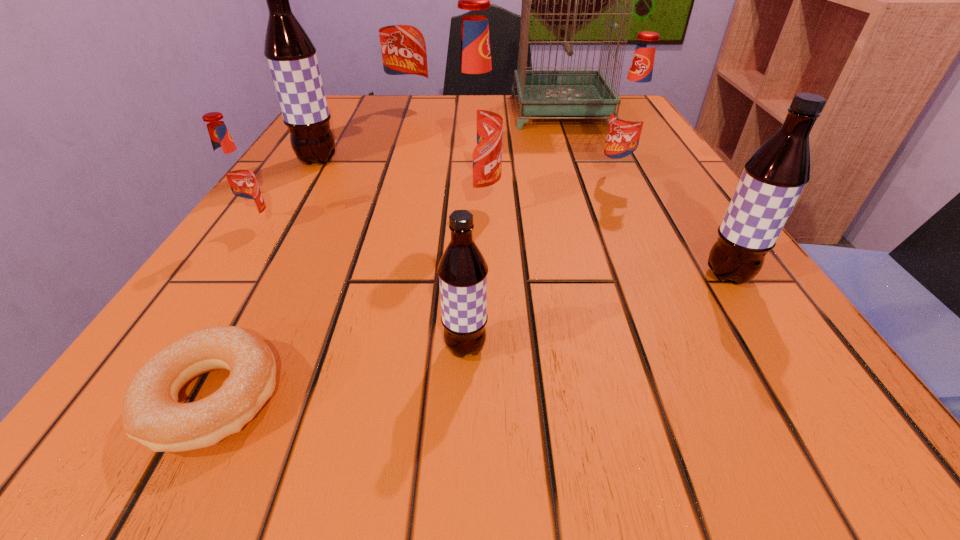
In the image, there is a desktop. Find the location of `blank space at the near right corner`. blank space at the near right corner is located at coordinates (841, 410).

Find the location of a particular element. The image size is (960, 540). unoccupied area between the leftmost red root beer and the second farthest red root beer is located at coordinates coord(437,203).

This screenshot has height=540, width=960. Find the location of `free space between the rightmost red root beer and the second biggest brown root beer`. free space between the rightmost red root beer and the second biggest brown root beer is located at coordinates (673, 227).

Locate an element on the screen. free spot between the biggest red root beer and the third red root beer from left to right is located at coordinates (443, 159).

What are the coordinates of `free point between the rightmost root beer and the leftmost red root beer` in the screenshot? It's located at (492, 252).

This screenshot has width=960, height=540. In order to click on free space between the second smallest red root beer and the second biggest red root beer in this screenshot , I will do `click(546, 192)`.

The width and height of the screenshot is (960, 540). I want to click on free space that is in between the birdcage and the biggest brown root beer, so click(439, 136).

Identify the location of vacant area that lies between the tallest object and the third smallest red root beer. (518, 159).

Where is `blank region between the tallest root beer and the smallest red root beer`? blank region between the tallest root beer and the smallest red root beer is located at coordinates (333, 170).

Identify the location of free spot between the birdcage and the second nearest brown root beer. The image size is (960, 540). (644, 193).